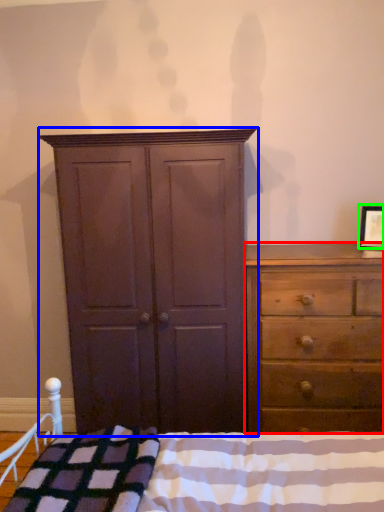
Question: Which object is the closest to the chest of drawers (highlighted by a red box)? Choose among these: cupboard (highlighted by a blue box) or picture frame (highlighted by a green box).

Choices:
 (A) cupboard
 (B) picture frame

Answer: (A)